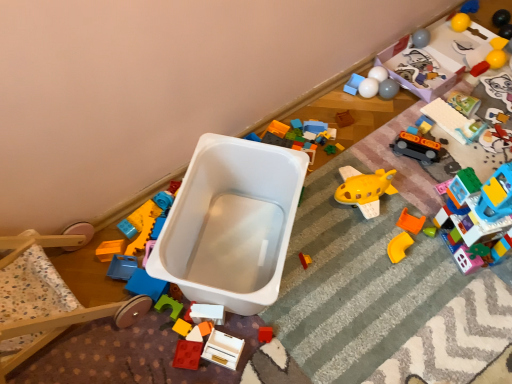
You are a GUI agent. You are given a task and a screenshot of the screen. Output one action in this format:
    pyautogui.click(x=<x>, y=<y>)
    Task: Click on the free space that is in between rubberized red brick at lower center, the 2th toy viewed from the left, and translucent plastic building blocks at right, positioned as the 12th toy in left-to-right order
    
    Given the screenshot: What is the action you would take?
    pyautogui.click(x=357, y=284)